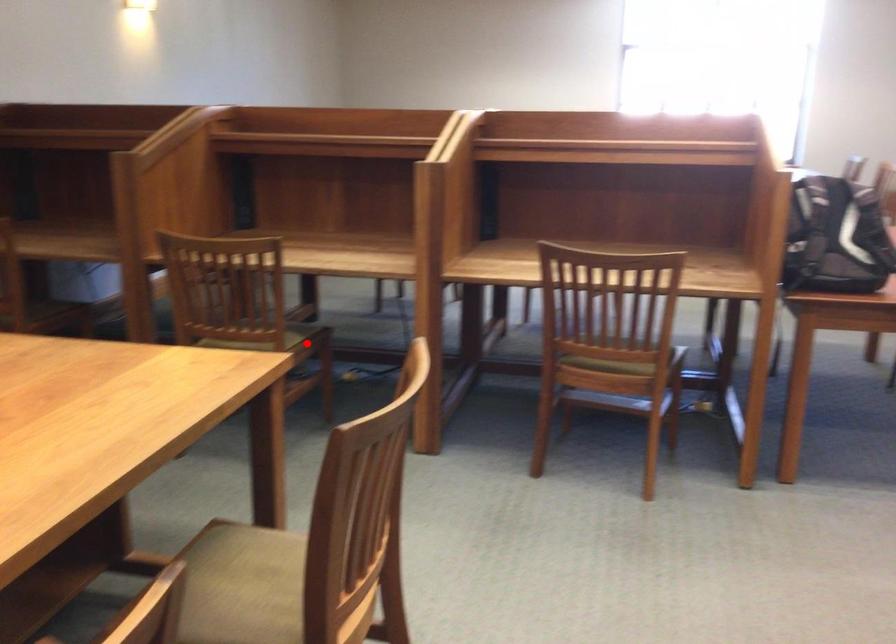
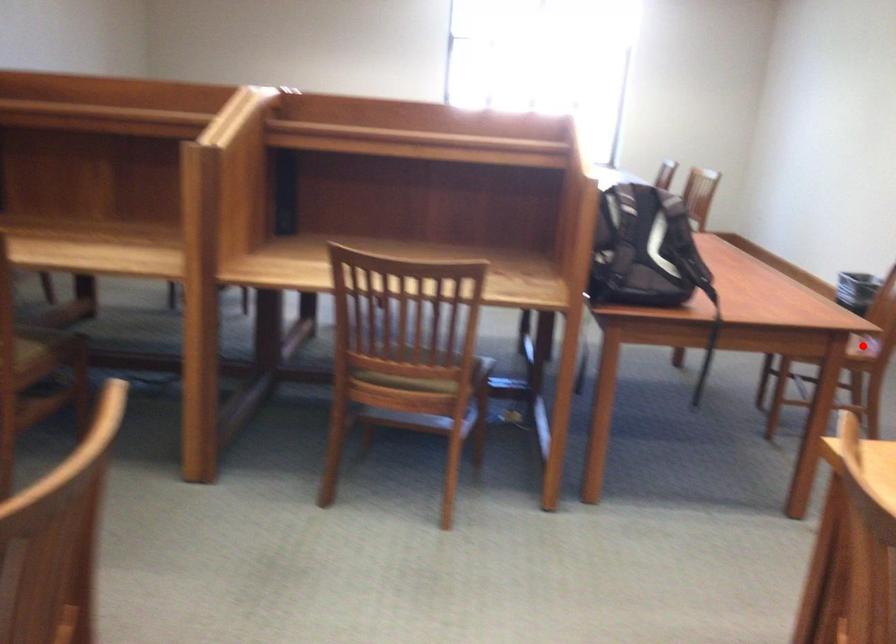
I am providing you with two images of the same scene from different viewpoints. A red point is marked on the first image and another point is marked on the second image. Is the marked point in image1 the same physical position as the marked point in image2?

No